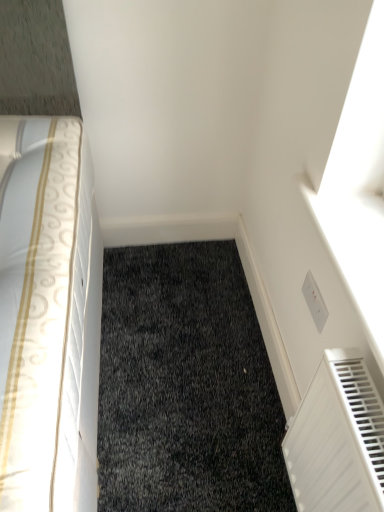
The height and width of the screenshot is (512, 384). I want to click on blank space above dark gray carpet at center (from a real-world perspective), so click(x=183, y=349).